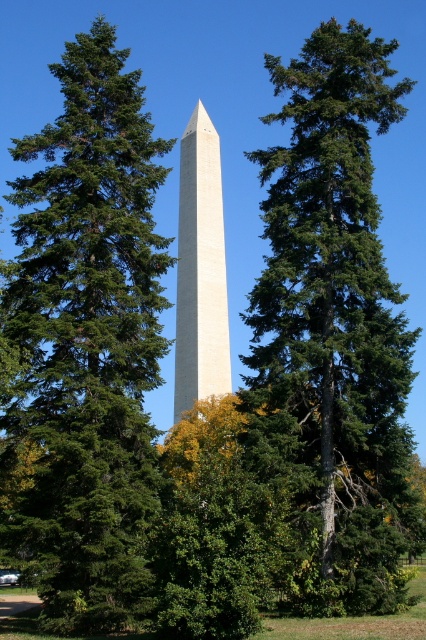
Question: Which object is the farthest from the green textured tree at center?

Choices:
 (A) green evergreen tree at center
 (B) white marble obelisk at center

Answer: (B)

Question: Does green textured tree at center have a lesser width compared to white marble obelisk at center?

Choices:
 (A) no
 (B) yes

Answer: (A)

Question: Is green evergreen tree at center thinner than white marble obelisk at center?

Choices:
 (A) yes
 (B) no

Answer: (B)

Question: Can you confirm if green evergreen tree at center is positioned to the left of green textured tree at center?

Choices:
 (A) yes
 (B) no

Answer: (A)

Question: Among these points, which one is nearest to the camera?

Choices:
 (A) (180, 177)
 (B) (155, 448)

Answer: (B)

Question: Which object is the closest to the green evergreen tree at center?

Choices:
 (A) white marble obelisk at center
 (B) green textured tree at center

Answer: (B)